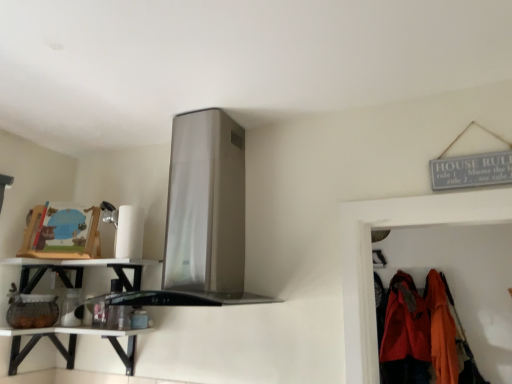
Question: Should I look upward or downward to see matte orange jacket at lower right, arranged as the first clothing when viewed from the left?

Choices:
 (A) down
 (B) up

Answer: (A)

Question: Are orange fabric coat at right, the second clothing in the left-to-right sequence, and matte orange jacket at lower right, arranged as the first clothing when viewed from the left, located far from each other?

Choices:
 (A) yes
 (B) no

Answer: (B)

Question: From a real-world perspective, is orange fabric coat at right, the second clothing in the left-to-right sequence, beneath matte orange jacket at lower right, arranged as the first clothing when viewed from the left?

Choices:
 (A) yes
 (B) no

Answer: (B)

Question: Is orange fabric coat at right, the second clothing in the left-to-right sequence, further to the viewer compared to matte orange jacket at lower right, arranged as the first clothing when viewed from the left?

Choices:
 (A) yes
 (B) no

Answer: (B)

Question: From a real-world perspective, is orange fabric coat at right, the second clothing in the left-to-right sequence, on matte orange jacket at lower right, arranged as the first clothing when viewed from the left?

Choices:
 (A) yes
 (B) no

Answer: (A)

Question: From the image's perspective, is orange fabric coat at right, the second clothing in the left-to-right sequence, over matte orange jacket at lower right, which is the second clothing from right to left?

Choices:
 (A) yes
 (B) no

Answer: (A)

Question: Is orange fabric coat at right, acting as the first clothing starting from the right, thinner than matte orange jacket at lower right, which is the second clothing from right to left?

Choices:
 (A) yes
 (B) no

Answer: (B)

Question: From the image's perspective, is matte orange jacket at lower right, which is the second clothing from right to left, on top of white glossy shelf at lower left?

Choices:
 (A) yes
 (B) no

Answer: (B)

Question: Can you confirm if matte orange jacket at lower right, which is the second clothing from right to left, is positioned to the right of white glossy shelf at lower left?

Choices:
 (A) yes
 (B) no

Answer: (A)

Question: Is matte orange jacket at lower right, arranged as the first clothing when viewed from the left, looking in the opposite direction of white glossy shelf at lower left?

Choices:
 (A) no
 (B) yes

Answer: (A)

Question: From a real-world perspective, is matte orange jacket at lower right, arranged as the first clothing when viewed from the left, beneath white glossy shelf at lower left?

Choices:
 (A) no
 (B) yes

Answer: (A)

Question: Is matte orange jacket at lower right, which is the second clothing from right to left, smaller than white glossy shelf at lower left?

Choices:
 (A) yes
 (B) no

Answer: (B)

Question: Considering the relative positions of matte orange jacket at lower right, which is the second clothing from right to left, and white glossy shelf at lower left in the image provided, is matte orange jacket at lower right, which is the second clothing from right to left, to the left of white glossy shelf at lower left from the viewer's perspective?

Choices:
 (A) yes
 (B) no

Answer: (B)

Question: Does white glossy shelf at lower left have a greater height compared to white glossy shelf at lower left?

Choices:
 (A) no
 (B) yes

Answer: (A)